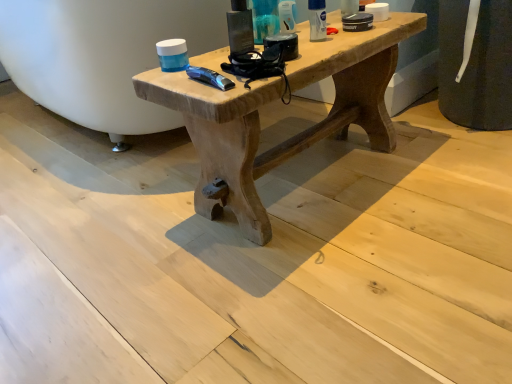
Locate an element on the screen. Image resolution: width=512 pixels, height=384 pixels. free point in front of natural wood table at center is located at coordinates (331, 277).